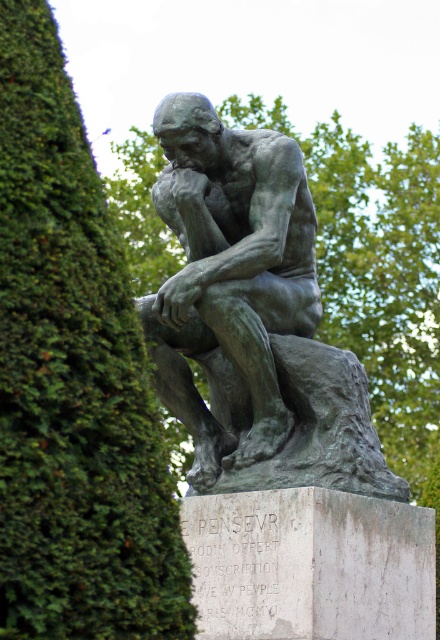
What is the spatial relationship between the green mossy hedge at left and the bronze statue at center?

The green mossy hedge at left is positioned below the bronze statue at center.

What is the relationship between the height of the green mossy hedge at left and the bronze statue at center?

The green mossy hedge at left is much taller than the bronze statue at center.

You are standing in a park and see the green mossy hedge at left and the bronze statue at center. Which object is positioned more to the left side of the park?

The green mossy hedge at left is positioned more to the left side of the park than the bronze statue at center.